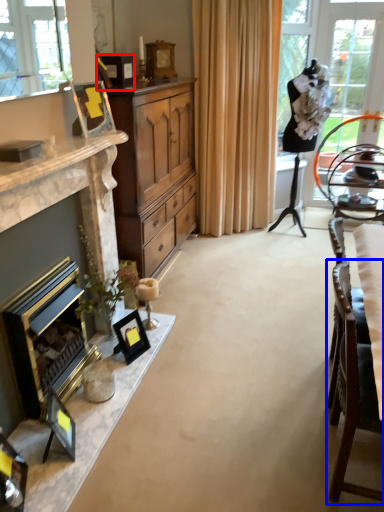
Question: Which object appears farthest to the camera in this image, picture frame (highlighted by a red box) or chair (highlighted by a blue box)?

Choices:
 (A) picture frame
 (B) chair

Answer: (A)